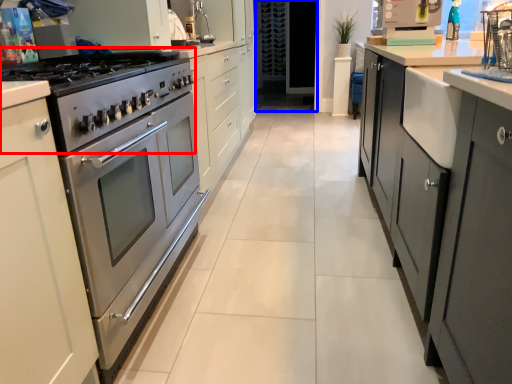
Question: Which of the following is the farthest to the observer, gas stove (highlighted by a red box) or glass door (highlighted by a blue box)?

Choices:
 (A) gas stove
 (B) glass door

Answer: (B)